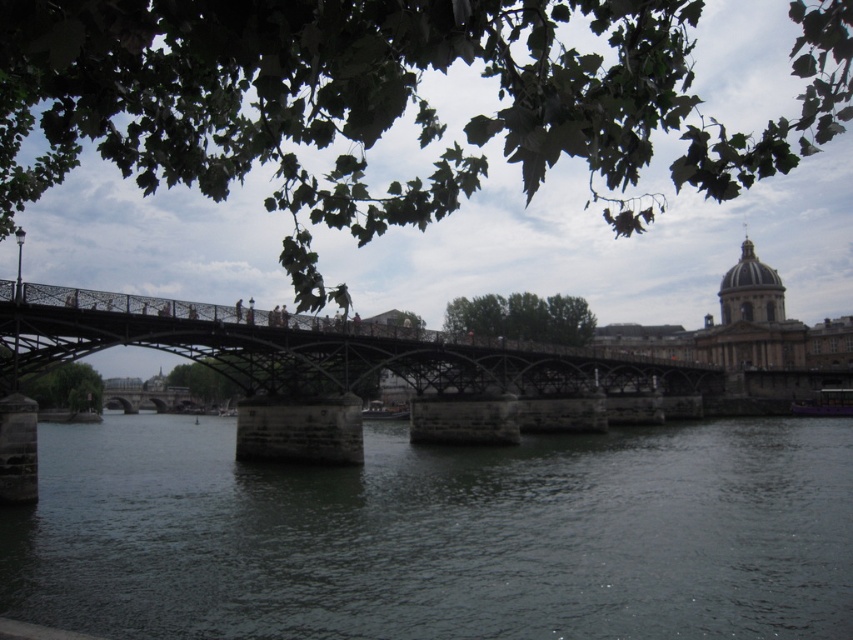
Question: Can you confirm if dark gray water at center is positioned to the left of green wrought iron bridge at center?

Choices:
 (A) no
 (B) yes

Answer: (B)

Question: Which point is closer to the camera?

Choices:
 (A) dark gray water at center
 (B) green wrought iron bridge at center

Answer: (A)

Question: Is dark gray water at center above green wrought iron bridge at center?

Choices:
 (A) no
 (B) yes

Answer: (A)

Question: Is dark gray water at center further to camera compared to green wrought iron bridge at center?

Choices:
 (A) yes
 (B) no

Answer: (B)